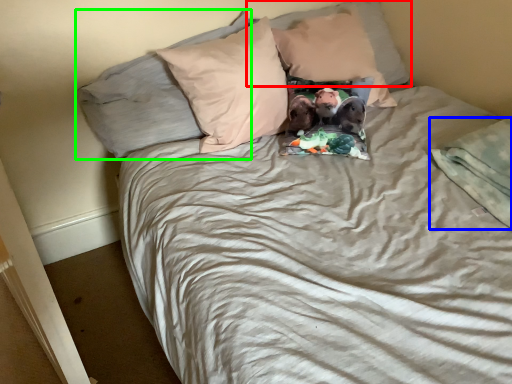
Question: Estimate the real-world distances between objects in this image. Which object is farther from pillow (highlighted by a red box), blanket (highlighted by a blue box) or pillow (highlighted by a green box)?

Choices:
 (A) blanket
 (B) pillow

Answer: (A)